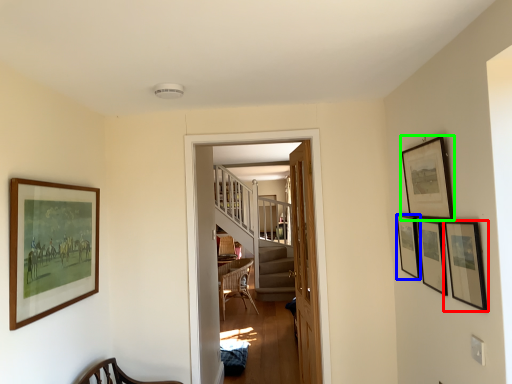
Question: Considering the real-world distances, which object is farthest from picture frame (highlighted by a red box)? picture frame (highlighted by a blue box) or picture frame (highlighted by a green box)?

Choices:
 (A) picture frame
 (B) picture frame

Answer: (A)